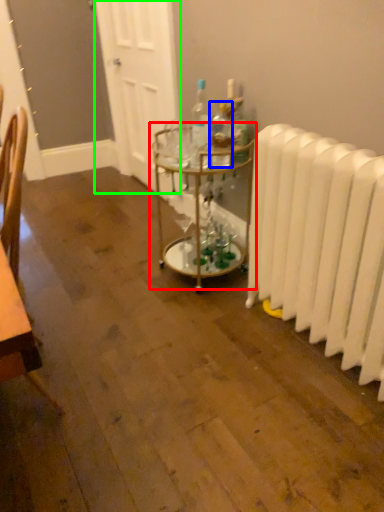
Question: Which object is the closest to the table (highlighted by a red box)? Choose among these: bottle (highlighted by a blue box) or door (highlighted by a green box).

Choices:
 (A) bottle
 (B) door

Answer: (A)